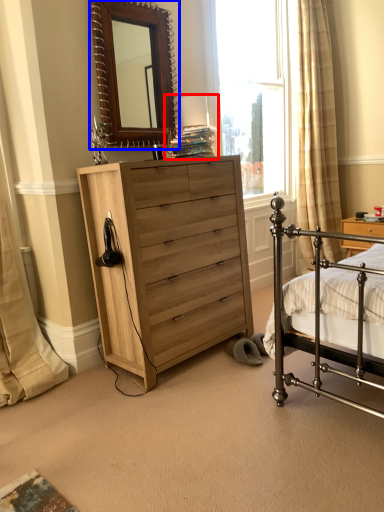
Question: Which point is further to the camera, table lamp (highlighted by a red box) or mirror (highlighted by a blue box)?

Choices:
 (A) table lamp
 (B) mirror

Answer: (A)